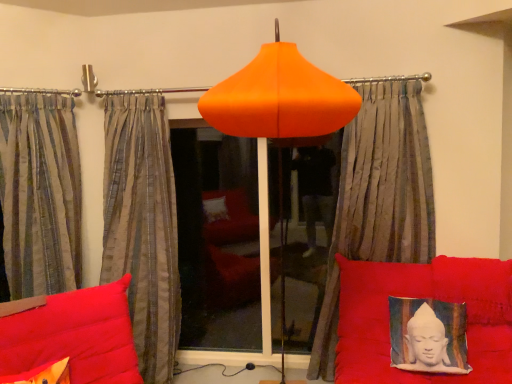
Question: Can you confirm if striped fabric curtain at left, which appears as the first curtain when viewed from the left, is bigger than textured fabric cushion with buddha print at lower right?

Choices:
 (A) yes
 (B) no

Answer: (A)

Question: Considering the relative sizes of striped fabric curtain at left, which appears as the 3th curtain when viewed from the right, and textured fabric cushion with buddha print at lower right in the image provided, is striped fabric curtain at left, which appears as the 3th curtain when viewed from the right, thinner than textured fabric cushion with buddha print at lower right?

Choices:
 (A) yes
 (B) no

Answer: (B)

Question: From a real-world perspective, does striped fabric curtain at left, which appears as the 3th curtain when viewed from the right, stand above textured fabric cushion with buddha print at lower right?

Choices:
 (A) yes
 (B) no

Answer: (A)

Question: Is striped fabric curtain at left, which appears as the first curtain when viewed from the left, closer to the viewer compared to textured fabric cushion with buddha print at lower right?

Choices:
 (A) yes
 (B) no

Answer: (B)

Question: Is textured fabric cushion with buddha print at lower right inside striped fabric curtain at left, which appears as the first curtain when viewed from the left?

Choices:
 (A) yes
 (B) no

Answer: (B)

Question: From a real-world perspective, does striped fabric curtain at left, which appears as the first curtain when viewed from the left, sit lower than textured fabric cushion with buddha print at lower right?

Choices:
 (A) no
 (B) yes

Answer: (A)

Question: Would you say transparent glass window at center is outside matte orange pillow at lower left?

Choices:
 (A) no
 (B) yes

Answer: (B)

Question: Are transparent glass window at center and matte orange pillow at lower left far apart?

Choices:
 (A) yes
 (B) no

Answer: (A)

Question: Is transparent glass window at center behind matte orange pillow at lower left?

Choices:
 (A) no
 (B) yes

Answer: (B)

Question: Does transparent glass window at center contain matte orange pillow at lower left?

Choices:
 (A) yes
 (B) no

Answer: (B)

Question: Can you confirm if transparent glass window at center is taller than matte orange pillow at lower left?

Choices:
 (A) yes
 (B) no

Answer: (A)

Question: Is transparent glass window at center facing away from matte orange pillow at lower left?

Choices:
 (A) yes
 (B) no

Answer: (B)

Question: Considering the relative sizes of silky gray curtain at center, acting as the first curtain starting from the right, and textured fabric cushion with buddha print at lower right in the image provided, is silky gray curtain at center, acting as the first curtain starting from the right, taller than textured fabric cushion with buddha print at lower right?

Choices:
 (A) no
 (B) yes

Answer: (B)